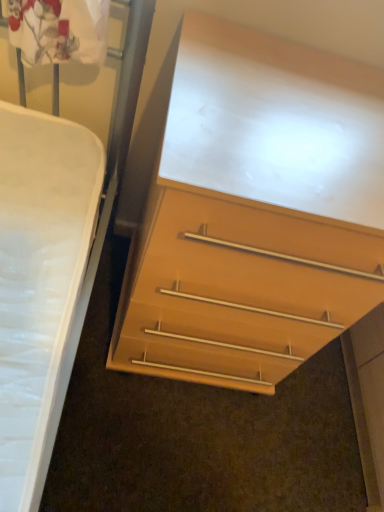
Identify the location of light wood/wooden chest of drawers at center. This screenshot has height=512, width=384. (255, 212).

This screenshot has height=512, width=384. Describe the element at coordinates (255, 212) in the screenshot. I see `light wood/wooden chest of drawers at center` at that location.

Locate an element on the screen. This screenshot has height=512, width=384. light wood/wooden chest of drawers at center is located at coordinates (255, 212).